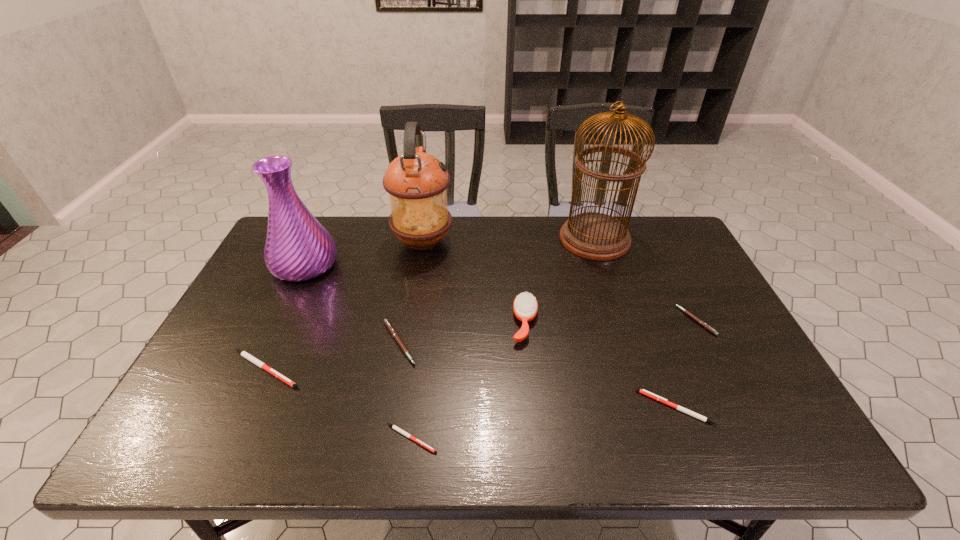
What are the coordinates of `the smaller pink pen` in the screenshot? It's located at (702, 323).

Identify the location of the rightmost white pen. (644, 392).

Where is `the second smallest white pen`? This screenshot has width=960, height=540. the second smallest white pen is located at coordinates (644, 392).

The width and height of the screenshot is (960, 540). Find the location of `the second white pen from right to left`. the second white pen from right to left is located at coordinates click(x=394, y=427).

Where is `the shortest pen`? This screenshot has width=960, height=540. the shortest pen is located at coordinates (394, 427).

You are a GUI agent. You are given a task and a screenshot of the screen. Output one action in this format:
    pyautogui.click(x=<x>, y=<y>)
    Task: Click on the vacant space situated on the front-facing side of the birdcage
    The width and height of the screenshot is (960, 540).
    Given the screenshot: What is the action you would take?
    pyautogui.click(x=479, y=239)

Identify the location of vacant space located on the front-facing side of the birdcage. The width and height of the screenshot is (960, 540). (446, 239).

You are a GUI agent. You are given a task and a screenshot of the screen. Output one action in this format:
    pyautogui.click(x=<x>, y=<y>)
    Task: Click on the free spot located 0.350m on the front-facing side of the birdcage
    This screenshot has height=540, width=960.
    Given the screenshot: What is the action you would take?
    pyautogui.click(x=456, y=239)

Where is `vacant position located on the right of the oil lamp`? vacant position located on the right of the oil lamp is located at coordinates (525, 242).

Where is `vacant point located 0.340m on the front of the third tallest object`? This screenshot has height=540, width=960. vacant point located 0.340m on the front of the third tallest object is located at coordinates (250, 383).